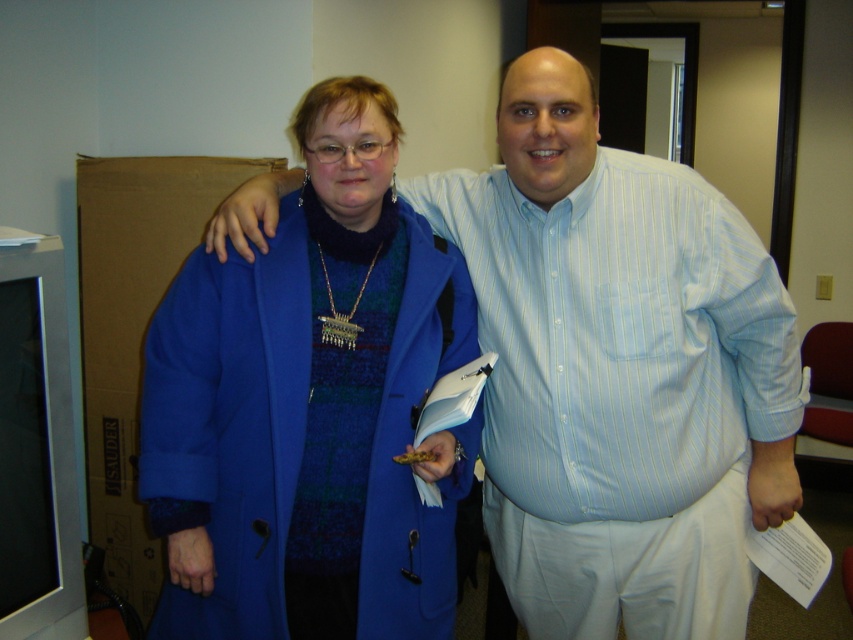
Which is above, light blue striped shirt at center or blue wool coat at center?

Positioned higher is light blue striped shirt at center.

Between point (514, 403) and point (288, 580), which one is positioned behind?

Positioned behind is point (514, 403).

Where is `light blue striped shirt at center`? The image size is (853, 640). light blue striped shirt at center is located at coordinates (614, 364).